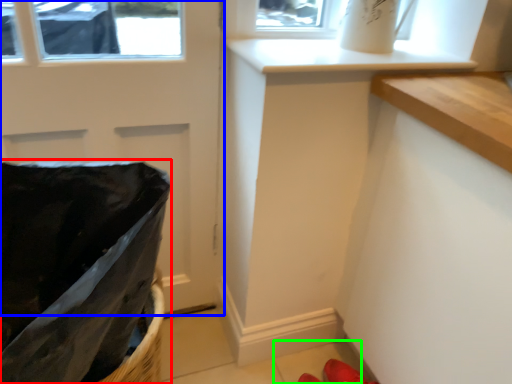
Question: Estimate the real-world distances between objects in this image. Which object is closer to laundry basket (highlighted by a red box), door (highlighted by a blue box) or tile (highlighted by a green box)?

Choices:
 (A) door
 (B) tile

Answer: (A)